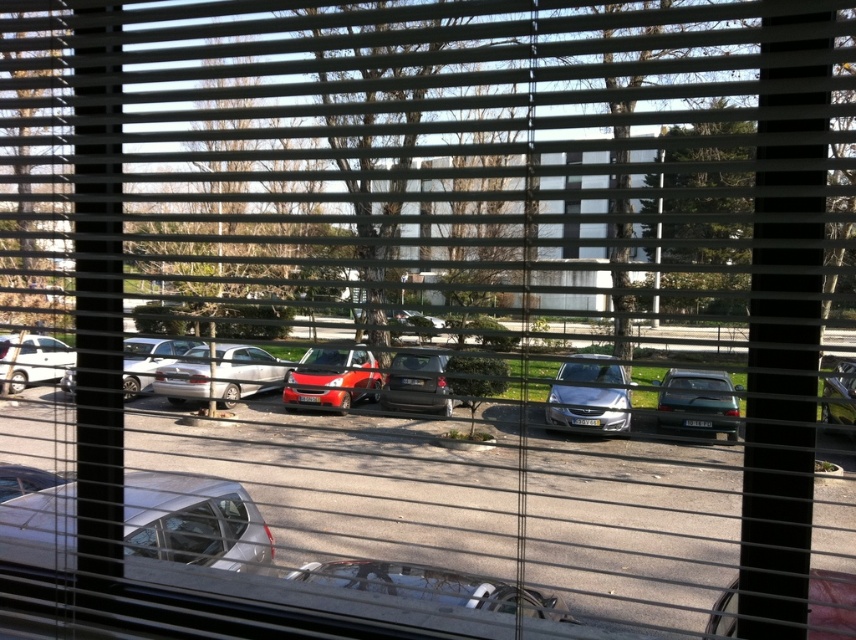
Can you confirm if shiny red car at center is positioned to the right of shiny dark green sedan at right?

Incorrect, shiny red car at center is not on the right side of shiny dark green sedan at right.

Does point (322, 388) lie behind point (676, 388)?

That is True.

This screenshot has width=856, height=640. I want to click on shiny red car at center, so click(331, 378).

Does silver metallic car at center have a lesser height compared to shiny dark green sedan at right?

Yes, silver metallic car at center is shorter than shiny dark green sedan at right.

Measure the distance between silver metallic car at center and shiny dark green sedan at right.

They are 2.76 meters apart.

Locate an element on the screen. silver metallic car at center is located at coordinates (587, 410).

Measure the distance between shiny red car at center and camera.

A distance of 1.81 meters exists between shiny red car at center and camera.

Find the location of `shiny red car at center`. shiny red car at center is located at coordinates (331, 378).

Find the location of `shiny red car at center`. shiny red car at center is located at coordinates (331, 378).